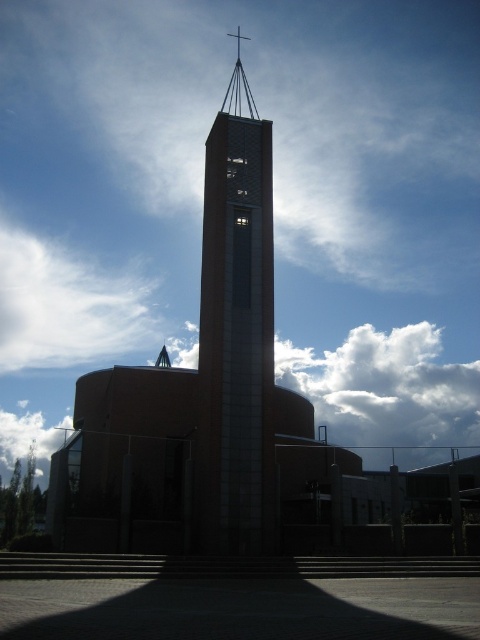
Question: Does smooth concrete bell tower at center lie behind white fluffy cloud at lower left?

Choices:
 (A) no
 (B) yes

Answer: (A)

Question: Among these points, which one is farthest from the camera?

Choices:
 (A) (269, 355)
 (B) (12, 420)

Answer: (B)

Question: Can you confirm if smooth concrete bell tower at center is thinner than white fluffy cloud at lower left?

Choices:
 (A) yes
 (B) no

Answer: (A)

Question: In this image, where is smooth concrete bell tower at center located relative to white fluffy cloud at lower left?

Choices:
 (A) below
 (B) above

Answer: (B)